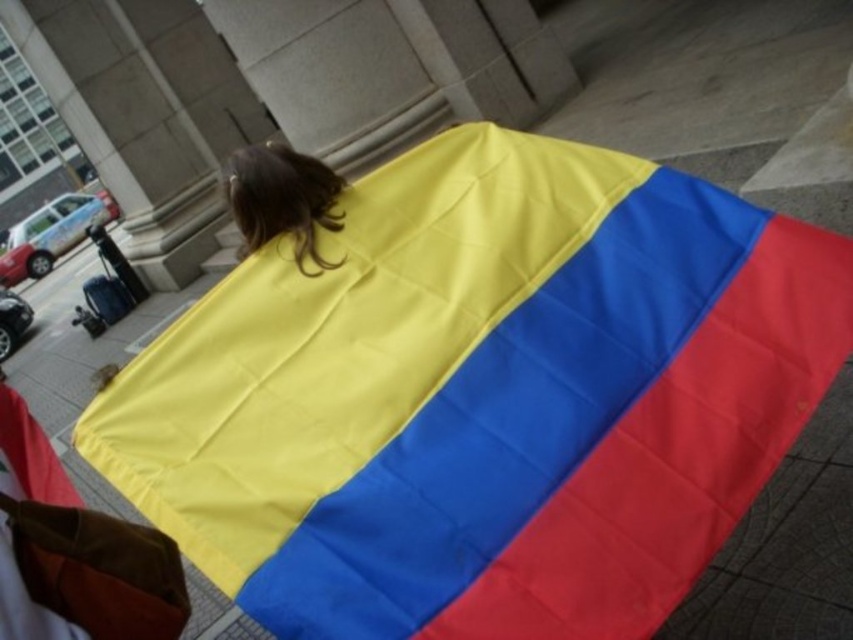
Does polyester flag at center appear under shiny brown hair at upper center?

Indeed, polyester flag at center is positioned under shiny brown hair at upper center.

Can you confirm if polyester flag at center is taller than shiny brown hair at upper center?

Correct, polyester flag at center is much taller as shiny brown hair at upper center.

Find the location of `polyester flag at center`. polyester flag at center is located at coordinates (482, 396).

At what (x,y) coordinates should I click in order to perform the action: click on polyester flag at center. Please return your answer as a coordinate pair (x, y). The image size is (853, 640). Looking at the image, I should click on (482, 396).